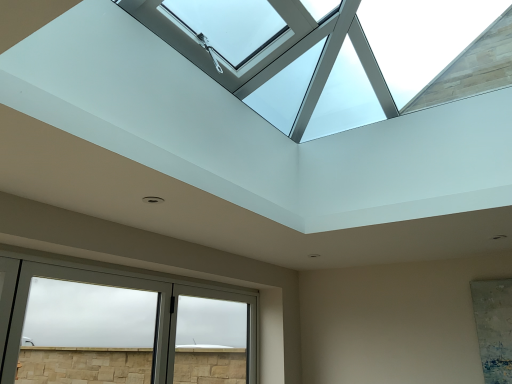
Question: Should I look upward or downward to see frosted glass screen door at lower center?

Choices:
 (A) up
 (B) down

Answer: (B)